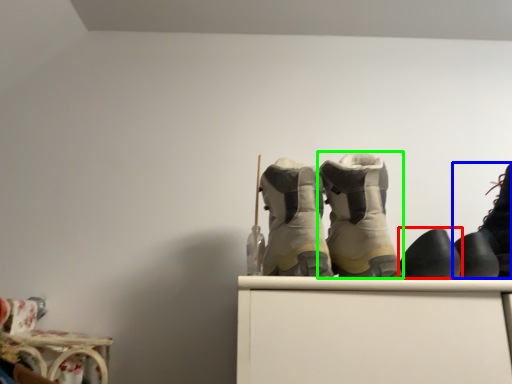
Question: Which object is the farthest from footwear (highlighted by a red box)? Choose among these: footwear (highlighted by a blue box) or footwear (highlighted by a green box).

Choices:
 (A) footwear
 (B) footwear

Answer: (A)